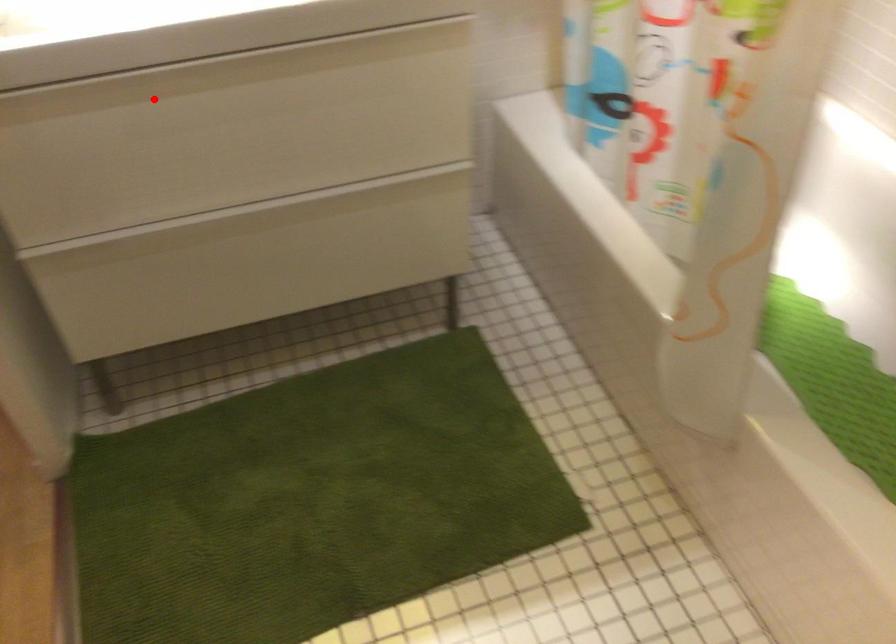
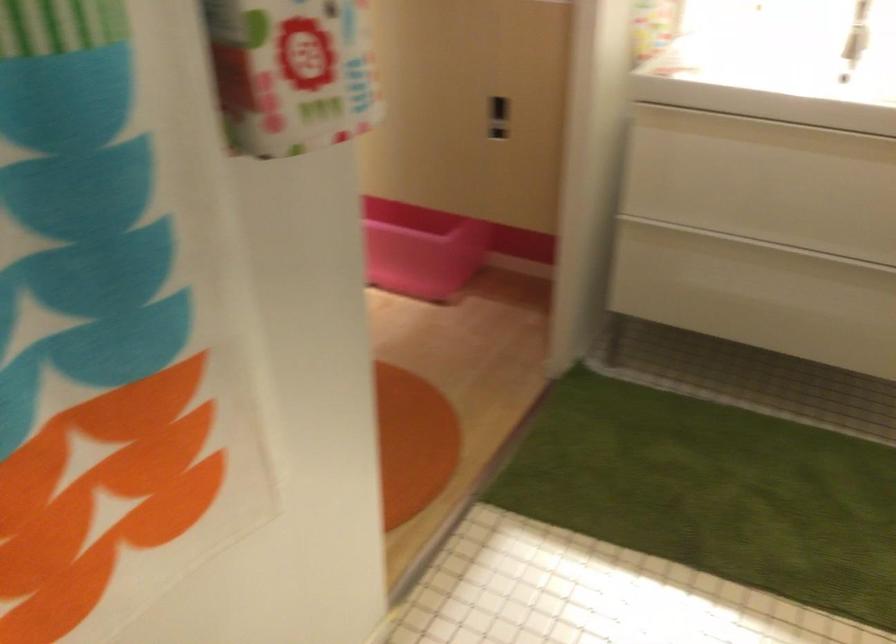
Locate, in the second image, the point that corresponds to the highlighted location in the first image.

(764, 131)